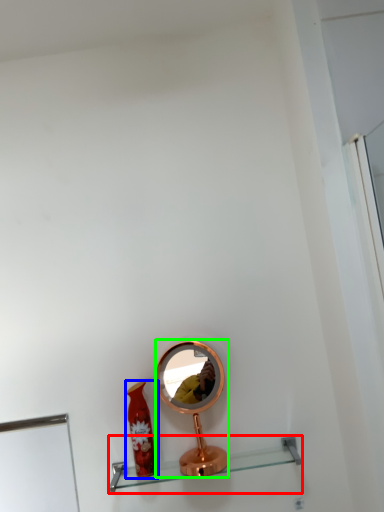
Question: Estimate the real-world distances between objects in this image. Which object is closer to shelf (highlighted by a red box), bottle (highlighted by a blue box) or mirror (highlighted by a green box)?

Choices:
 (A) bottle
 (B) mirror

Answer: (A)